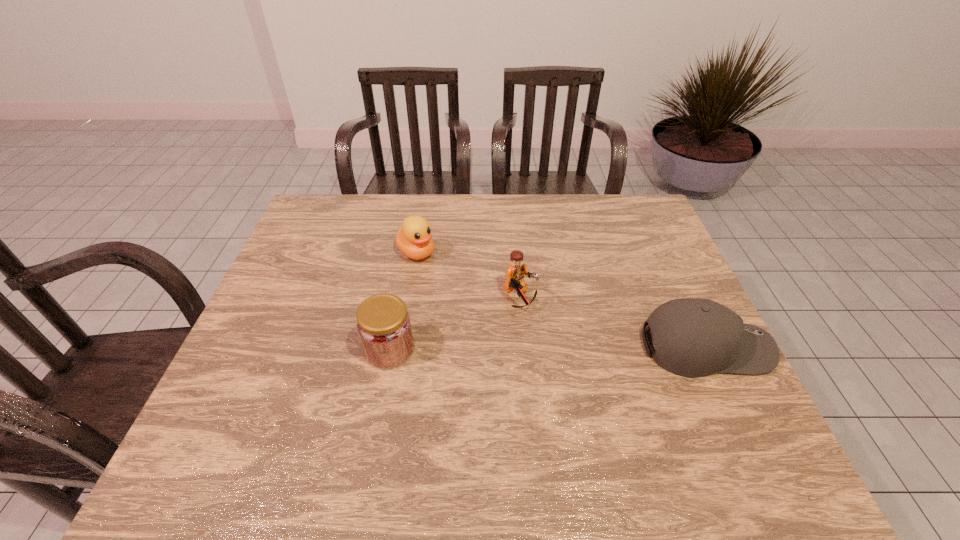
Where is `vacant point located holding a crossbow in the hands of the Lego`? The height and width of the screenshot is (540, 960). vacant point located holding a crossbow in the hands of the Lego is located at coordinates (556, 334).

This screenshot has width=960, height=540. I want to click on free space located holding a crossbow in the hands of the Lego, so click(x=592, y=365).

You are a GUI agent. You are given a task and a screenshot of the screen. Output one action in this format:
    pyautogui.click(x=<x>, y=<y>)
    Task: Click on the object that is at the right edge
    The height and width of the screenshot is (540, 960).
    Given the screenshot: What is the action you would take?
    pyautogui.click(x=693, y=337)

Image resolution: width=960 pixels, height=540 pixels. Find the location of `vacant space at the far edge of the desktop`. vacant space at the far edge of the desktop is located at coordinates (436, 197).

At what (x,y) coordinates should I click in order to perform the action: click on vacant region at the near edge of the desktop. Please return your answer as a coordinate pair (x, y). This screenshot has width=960, height=540. Looking at the image, I should click on (434, 406).

In the image, there is a desktop. Where is `vacant space at the left edge`? vacant space at the left edge is located at coordinates click(x=325, y=297).

In order to click on blank area at the right edge in this screenshot , I will do `click(675, 269)`.

In the image, there is a desktop. What are the coordinates of `free space at the far left corner` in the screenshot? It's located at (322, 215).

You are a GUI agent. You are given a task and a screenshot of the screen. Output one action in this format:
    pyautogui.click(x=<x>, y=<y>)
    Task: Click on the vacant area at the far right corner
    The height and width of the screenshot is (540, 960).
    Given the screenshot: What is the action you would take?
    pyautogui.click(x=612, y=204)

You are a GUI agent. You are given a task and a screenshot of the screen. Output one action in this format:
    pyautogui.click(x=<x>, y=<y>)
    Task: Click on the free space between the duckling and the third object from left to right
    Image resolution: width=960 pixels, height=540 pixels.
    Given the screenshot: What is the action you would take?
    point(468,275)